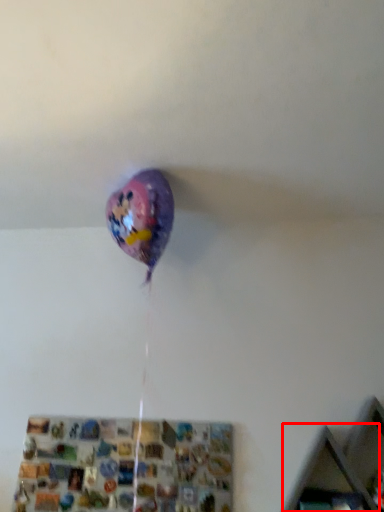
Question: From the image, what is the correct spatial relationship of shelf (annotated by the red box) in relation to shelf?

Choices:
 (A) right
 (B) left

Answer: (A)